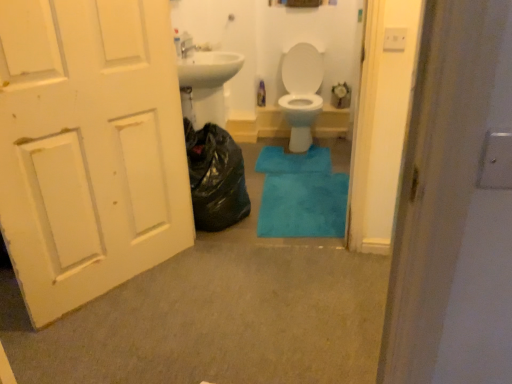
This screenshot has height=384, width=512. I want to click on vacant space in white painted wood door at left (from a real-world perspective), so click(x=112, y=287).